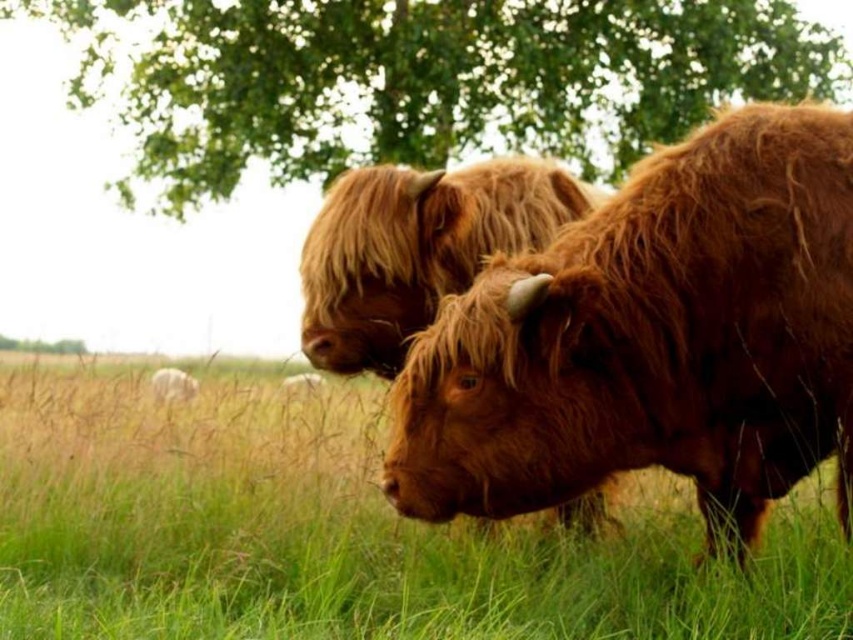
Does green grassy at center have a greater height compared to green leafy tree at upper center?

In fact, green grassy at center may be shorter than green leafy tree at upper center.

Is green grassy at center closer to camera compared to green leafy tree at upper center?

Yes, it is.

What do you see at coordinates (343, 529) in the screenshot? I see `green grassy at center` at bounding box center [343, 529].

Image resolution: width=853 pixels, height=640 pixels. I want to click on green grassy at center, so click(343, 529).

Does brown fuzzy cow at center come behind fuzzy brown yak at center?

No, brown fuzzy cow at center is closer to the viewer.

Is brown fuzzy cow at center smaller than fuzzy brown yak at center?

Incorrect, brown fuzzy cow at center is not smaller in size than fuzzy brown yak at center.

Image resolution: width=853 pixels, height=640 pixels. Find the location of `brown fuzzy cow at center`. brown fuzzy cow at center is located at coordinates (653, 339).

Does brown fuzzy cow at center have a greater height compared to green leafy tree at upper center?

No, brown fuzzy cow at center is not taller than green leafy tree at upper center.

Who is lower down, brown fuzzy cow at center or green leafy tree at upper center?

Positioned lower is brown fuzzy cow at center.

Between point (614, 195) and point (802, 61), which one is positioned behind?

Point (802, 61)

The image size is (853, 640). Identify the location of brown fuzzy cow at center. (653, 339).